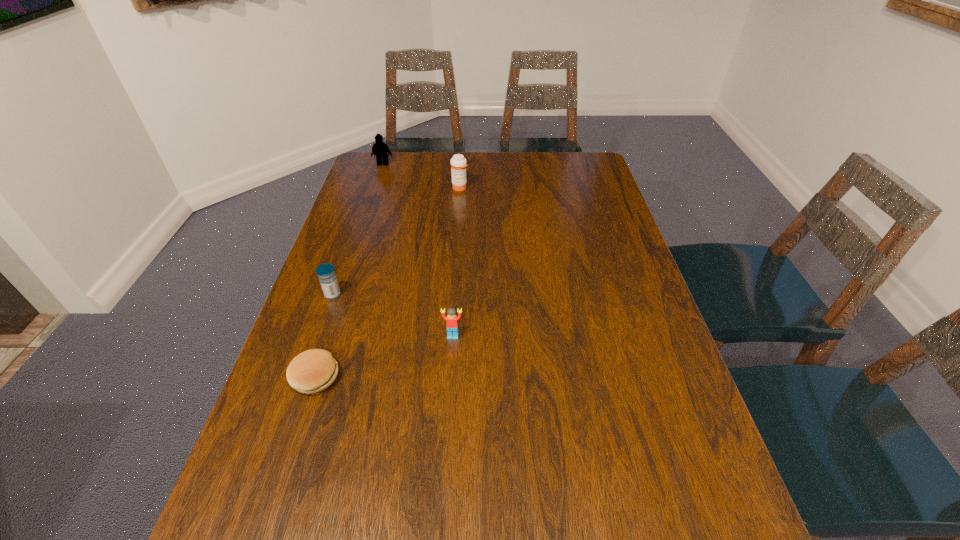
Find the location of `vacant point located on the left of the right medicine`. vacant point located on the left of the right medicine is located at coordinates (383, 188).

Find the location of a particular element. free region located 0.330m on the face of the farthest object is located at coordinates point(366,217).

This screenshot has height=540, width=960. Identify the location of vacant area situated 0.360m on the face of the shorter Lego. (444, 497).

Find the location of a particular element. vacant space located 0.180m on the right of the shorter medicine is located at coordinates coord(410,295).

This screenshot has width=960, height=540. Identify the location of vacant position located 0.120m on the right of the patty. (394, 377).

This screenshot has height=540, width=960. Identify the location of medicine at the far edge. (458, 163).

This screenshot has width=960, height=540. I want to click on Lego that is at the far edge, so click(x=380, y=149).

Locate an element on the screen. The width and height of the screenshot is (960, 540). Lego that is positioned at the left edge is located at coordinates [380, 149].

At what (x,y) coordinates should I click in order to perform the action: click on medicine located at the left edge. Please return your answer as a coordinate pair (x, y). This screenshot has width=960, height=540. Looking at the image, I should click on (326, 273).

I want to click on patty positioned at the left edge, so click(x=311, y=372).